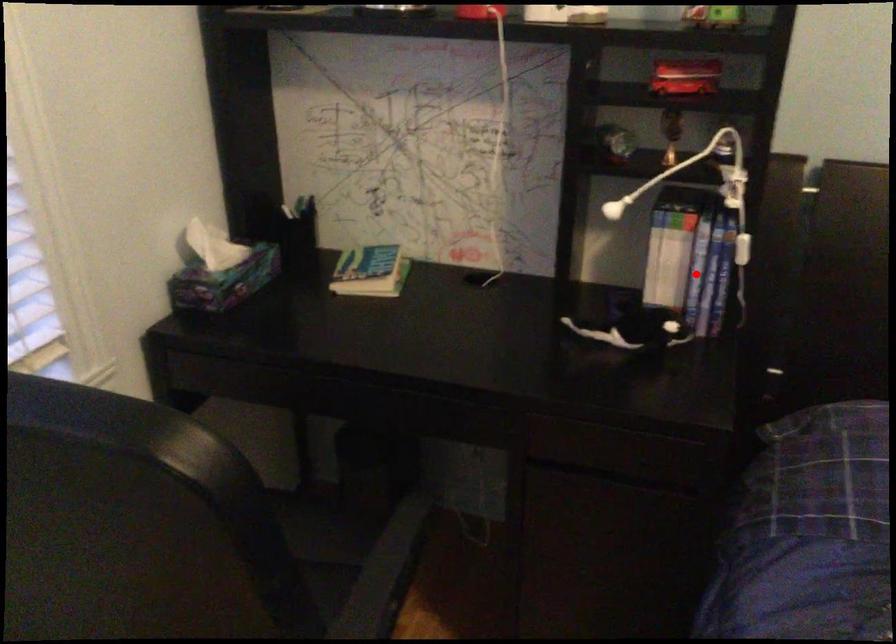
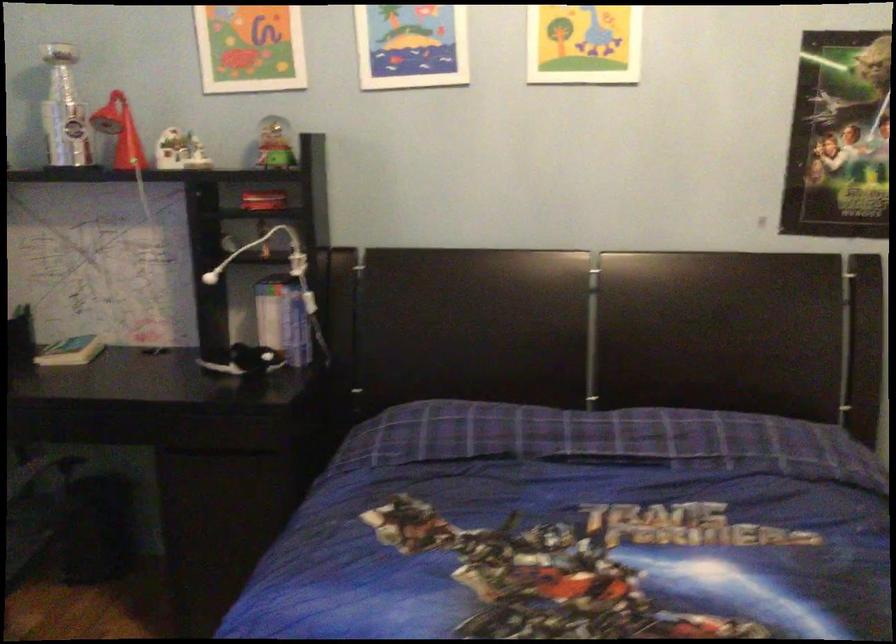
Locate, in the second image, the point that corresponds to the highlighted location in the first image.

(288, 321)